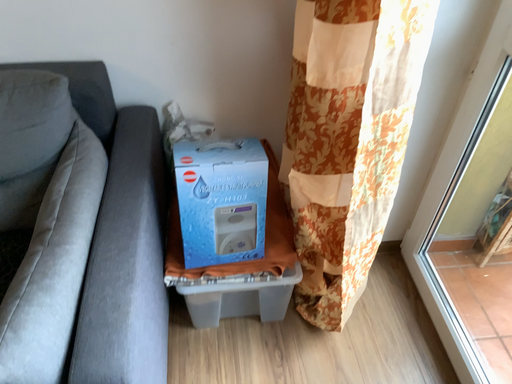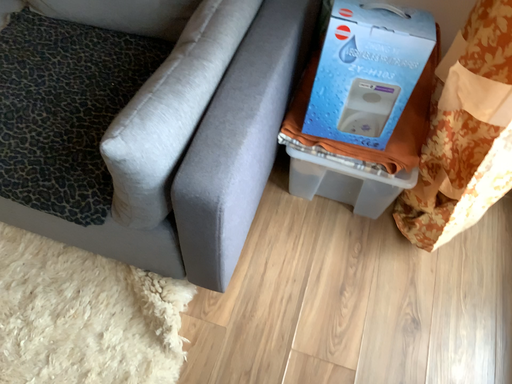
Question: How did the camera likely rotate when shooting the video?

Choices:
 (A) rotated left
 (B) rotated right

Answer: (A)